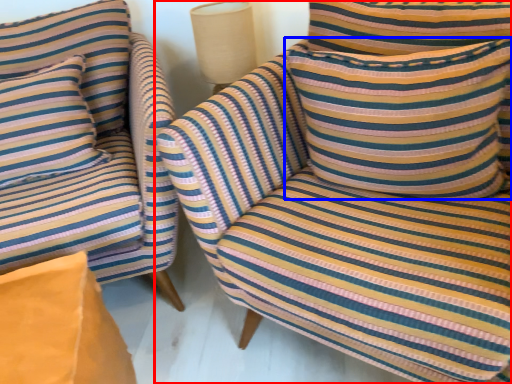
Question: Which point is further to the camera, chair (highlighted by a red box) or pillow (highlighted by a blue box)?

Choices:
 (A) chair
 (B) pillow

Answer: (B)